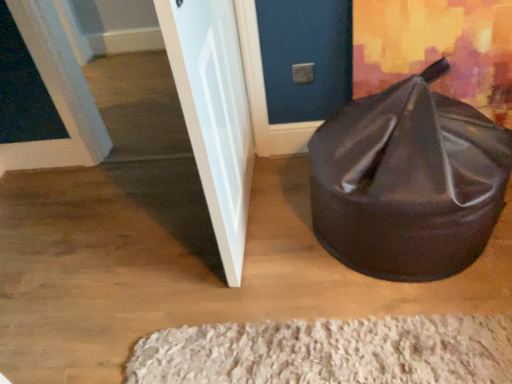
Locate an element on the screen. This screenshot has width=512, height=384. free space between black leather bean bag at lower right and white shaggy rug at lower center is located at coordinates (x=285, y=264).